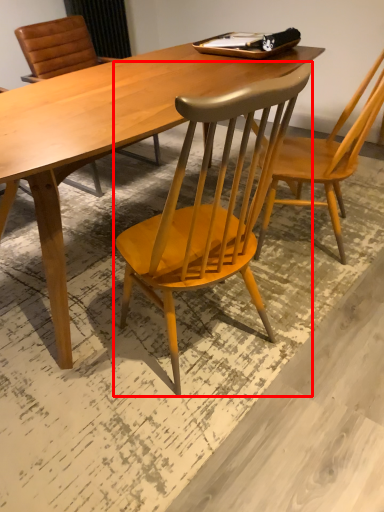
Question: From the image's perspective, considering the relative positions of chair (annotated by the red box) and chair in the image provided, where is chair (annotated by the red box) located with respect to the staircase?

Choices:
 (A) above
 (B) below

Answer: (B)